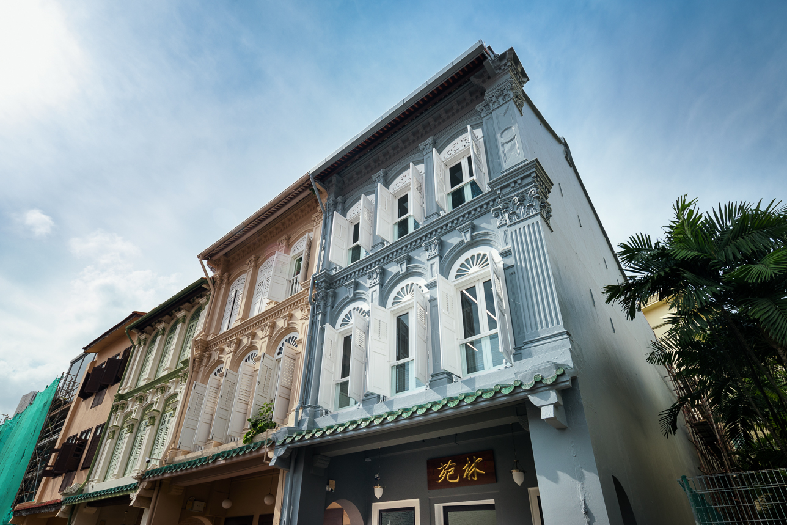
Find the location of a particular element. Image resolution: width=787 pixels, height=525 pixels. door is located at coordinates (407, 517), (239, 524).